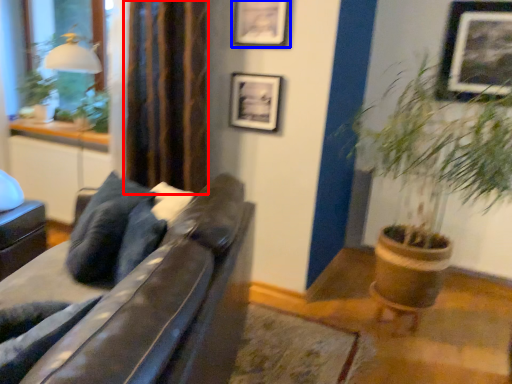
Question: Among these objects, which one is nearest to the camera, curtain (highlighted by a red box) or picture frame (highlighted by a blue box)?

Choices:
 (A) curtain
 (B) picture frame

Answer: (A)